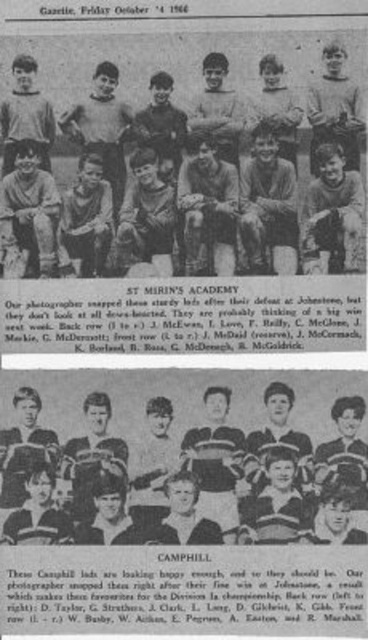
Can you confirm if matte gray uniforms at center is thinner than striped jersey baseball team at lower center?

In fact, matte gray uniforms at center might be wider than striped jersey baseball team at lower center.

Which is more to the right, matte gray uniforms at center or striped jersey baseball team at lower center?

From the viewer's perspective, striped jersey baseball team at lower center appears more on the right side.

Where is `matte gray uniforms at center`? The image size is (368, 640). matte gray uniforms at center is located at coordinates (182, 156).